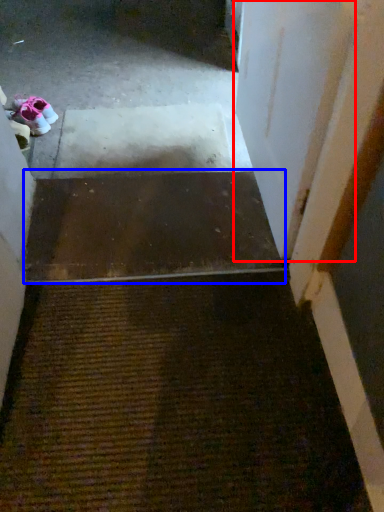
Question: Which point is further to the camera, door (highlighted by a red box) or stairs (highlighted by a blue box)?

Choices:
 (A) door
 (B) stairs

Answer: (B)